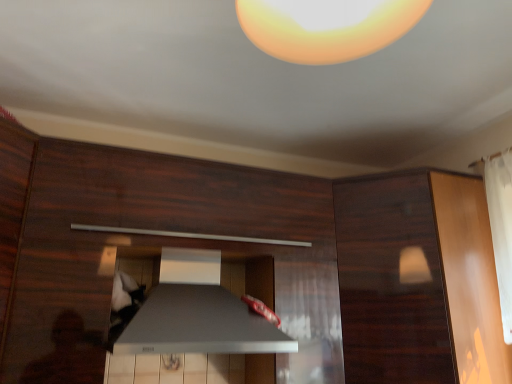
Find the location of a particular element. satin silver exhaust hood at center is located at coordinates (199, 324).

From the picture: Considering the relative sizes of satin silver exhaust hood at center and dark wood cabinet at upper right in the image provided, is satin silver exhaust hood at center thinner than dark wood cabinet at upper right?

Yes, satin silver exhaust hood at center is thinner than dark wood cabinet at upper right.

Considering their positions, is satin silver exhaust hood at center located in front of or behind dark wood cabinet at upper right?

satin silver exhaust hood at center is positioned closer to the viewer than dark wood cabinet at upper right.

Is satin silver exhaust hood at center taller than dark wood cabinet at upper right?

No.

How different are the orientations of satin silver exhaust hood at center and dark wood cabinet at upper right in degrees?

The angle between the facing direction of satin silver exhaust hood at center and the facing direction of dark wood cabinet at upper right is 0.065 degrees.

Which is more to the right, dark wood cabinet at upper right or satin silver exhaust hood at center?

dark wood cabinet at upper right.

From the picture: In terms of size, does dark wood cabinet at upper right appear bigger or smaller than satin silver exhaust hood at center?

In the image, dark wood cabinet at upper right appears to be larger than satin silver exhaust hood at center.

From a real-world perspective, is dark wood cabinet at upper right physically located above or below satin silver exhaust hood at center?

dark wood cabinet at upper right is situated higher than satin silver exhaust hood at center in the real world.

Does dark wood cabinet at upper right have a lesser width compared to satin silver exhaust hood at center?

In fact, dark wood cabinet at upper right might be wider than satin silver exhaust hood at center.

Considering the sizes of objects dark wood cabinet at upper right and satin silver drawer at center in the image provided, who is wider, dark wood cabinet at upper right or satin silver drawer at center?

satin silver drawer at center is wider.

Can you confirm if dark wood cabinet at upper right is taller than satin silver drawer at center?

Yes, dark wood cabinet at upper right is taller than satin silver drawer at center.

Could you tell me if dark wood cabinet at upper right is facing satin silver drawer at center?

Yes, dark wood cabinet at upper right is oriented towards satin silver drawer at center.

Do you think satin silver drawer at center is within dark wood cabinet at upper right, or outside of it?

satin silver drawer at center exists outside the volume of dark wood cabinet at upper right.

In the scene shown: Does satin silver drawer at center have a larger size compared to dark wood cabinet at upper right?

Indeed, satin silver drawer at center has a larger size compared to dark wood cabinet at upper right.

Between satin silver drawer at center and dark wood cabinet at upper right, which one appears on the left side from the viewer's perspective?

satin silver drawer at center.

Considering the sizes of objects satin silver drawer at center and dark wood cabinet at upper right in the image provided, who is shorter, satin silver drawer at center or dark wood cabinet at upper right?

With less height is satin silver drawer at center.

How far apart are satin silver drawer at center and satin silver exhaust hood at center?

32.49 centimeters.

Is satin silver drawer at center situated inside satin silver exhaust hood at center or outside?

The correct answer is: outside.

Is satin silver drawer at center taller or shorter than satin silver exhaust hood at center?

Considering their sizes, satin silver drawer at center has more height than satin silver exhaust hood at center.

Which object is thinner, satin silver exhaust hood at center or satin silver drawer at center?

satin silver exhaust hood at center.

Does satin silver exhaust hood at center have a larger size compared to satin silver drawer at center?

No.

From a real-world perspective, is satin silver exhaust hood at center located beneath satin silver drawer at center?

Yes, from a real-world perspective, satin silver exhaust hood at center is under satin silver drawer at center.

Image resolution: width=512 pixels, height=384 pixels. I want to click on exhaust hood directly beneath the dark wood cabinet at upper right (from a real-world perspective), so click(199, 324).

Where is `cabinetry lying on the right of satin silver exhaust hood at center`? This screenshot has height=384, width=512. cabinetry lying on the right of satin silver exhaust hood at center is located at coordinates (418, 280).

Based on their spatial positions, is satin silver drawer at center or dark wood cabinet at upper right further from satin silver exhaust hood at center?

Among the two, dark wood cabinet at upper right is located further to satin silver exhaust hood at center.

Based on their spatial positions, is satin silver exhaust hood at center or dark wood cabinet at upper right closer to satin silver drawer at center?

Based on the image, dark wood cabinet at upper right appears to be nearer to satin silver drawer at center.

When comparing their distances from dark wood cabinet at upper right, does satin silver drawer at center or satin silver exhaust hood at center seem further?

satin silver exhaust hood at center lies further to dark wood cabinet at upper right than the other object.

Which object lies further to the anchor point satin silver exhaust hood at center, dark wood cabinet at upper right or satin silver drawer at center?

dark wood cabinet at upper right.

Considering their positions, is satin silver exhaust hood at center positioned further to dark wood cabinet at upper right than satin silver drawer at center?

satin silver exhaust hood at center is positioned further to the anchor dark wood cabinet at upper right.

From the image, which object appears to be nearer to satin silver drawer at center, dark wood cabinet at upper right or satin silver exhaust hood at center?

dark wood cabinet at upper right is closer to satin silver drawer at center.

Where is `exhaust hood positioned between satin silver drawer at center and dark wood cabinet at upper right from near to far`? Image resolution: width=512 pixels, height=384 pixels. exhaust hood positioned between satin silver drawer at center and dark wood cabinet at upper right from near to far is located at coordinates (199, 324).